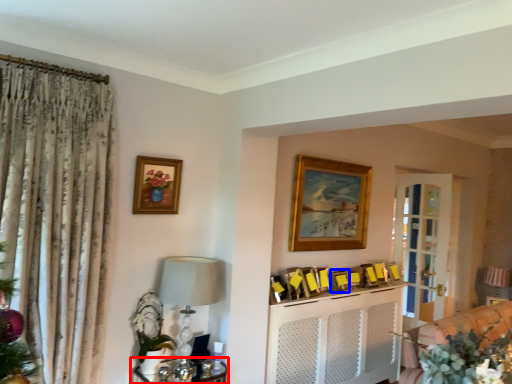
Question: Which object is further to the camera taking this photo, furniture (highlighted by a red box) or picture frame (highlighted by a blue box)?

Choices:
 (A) furniture
 (B) picture frame

Answer: (B)